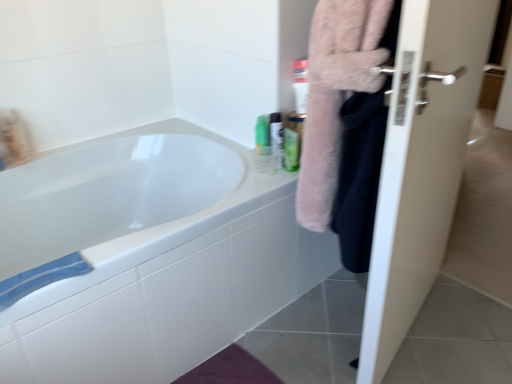
Locate an element on the screen. free location in front of green plastic bottle at upper right, acting as the 2th mouthwash starting from the left is located at coordinates (264, 173).